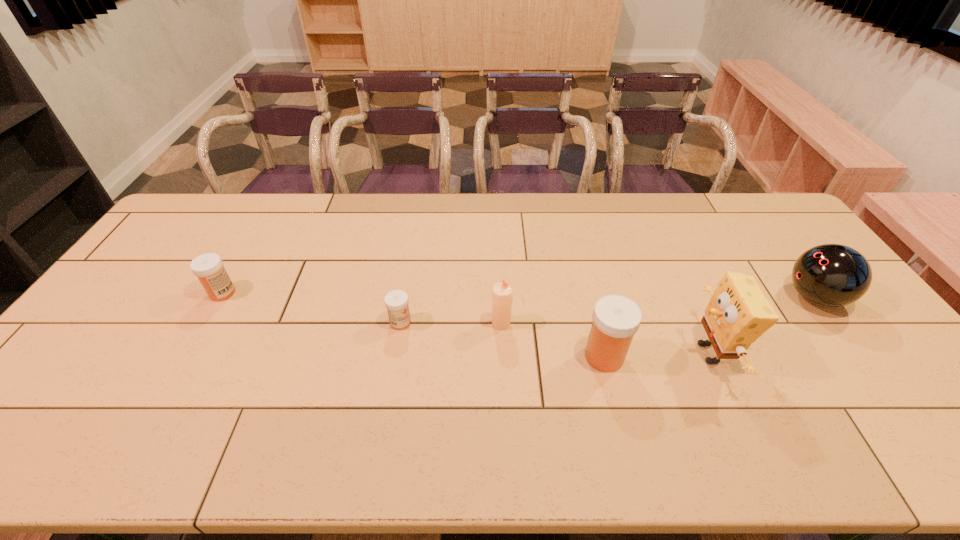
Please point a spot to add another medicine on the right. Please provide its 2D coordinates. Your answer should be formatted as a tuple, i.e. [(x, y)], where the tuple contains the x and y coordinates of a point satisfying the conditions above.

[(839, 395)]